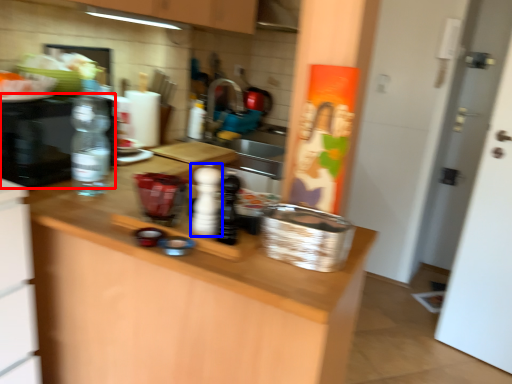
Question: Which point is closer to the camera, appliance (highlighted by a red box) or bottle (highlighted by a blue box)?

Choices:
 (A) appliance
 (B) bottle

Answer: (B)